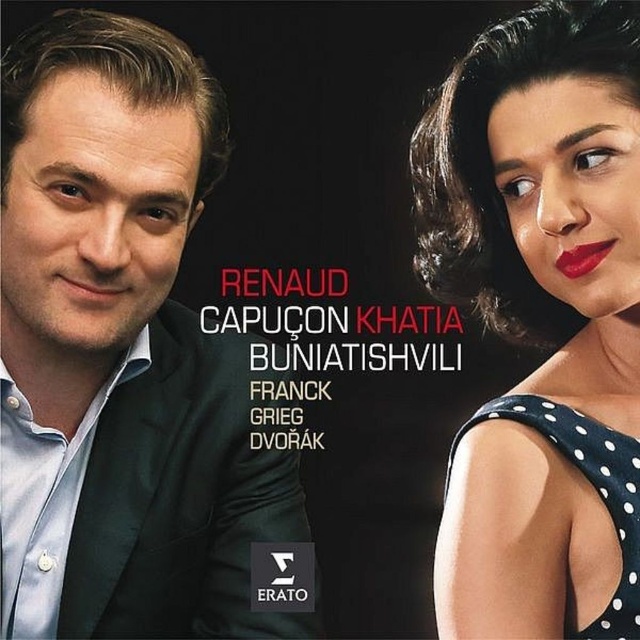
Question: Can you confirm if blue shirt at left is positioned to the right of black polka dot dress at upper right?

Choices:
 (A) yes
 (B) no

Answer: (B)

Question: Can you confirm if blue shirt at left is positioned below black polka dot dress at upper right?

Choices:
 (A) yes
 (B) no

Answer: (A)

Question: Estimate the real-world distances between objects in this image. Which object is closer to the blue shirt at left?

Choices:
 (A) black polka dot dress at upper right
 (B) matte red lipstick at upper right

Answer: (A)

Question: Is blue shirt at left smaller than matte red lipstick at upper right?

Choices:
 (A) no
 (B) yes

Answer: (A)

Question: Which object is farther from the camera taking this photo?

Choices:
 (A) blue shirt at left
 (B) matte red lipstick at upper right
 (C) black polka dot dress at upper right

Answer: (A)

Question: Which object is farther from the camera taking this photo?

Choices:
 (A) blue shirt at left
 (B) black polka dot dress at upper right

Answer: (A)